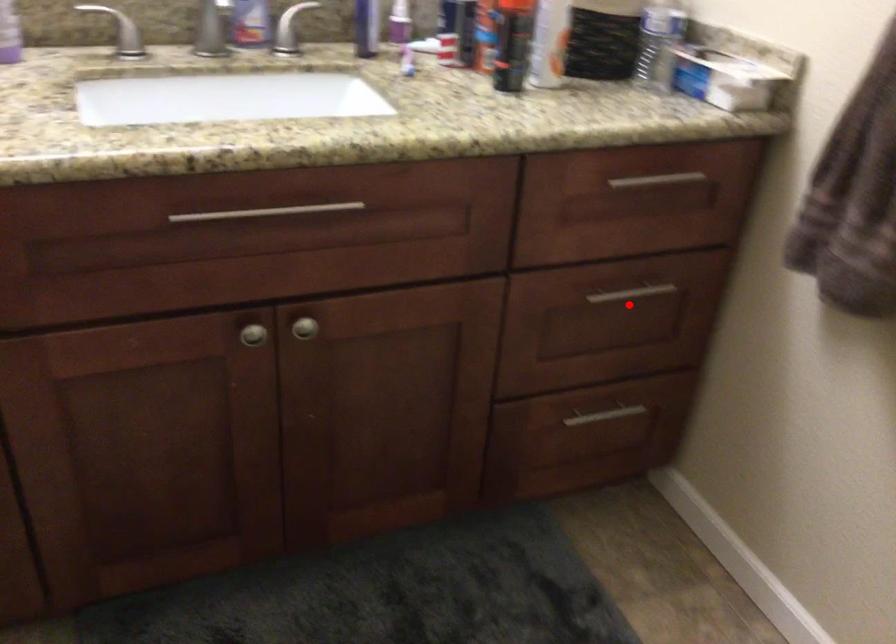
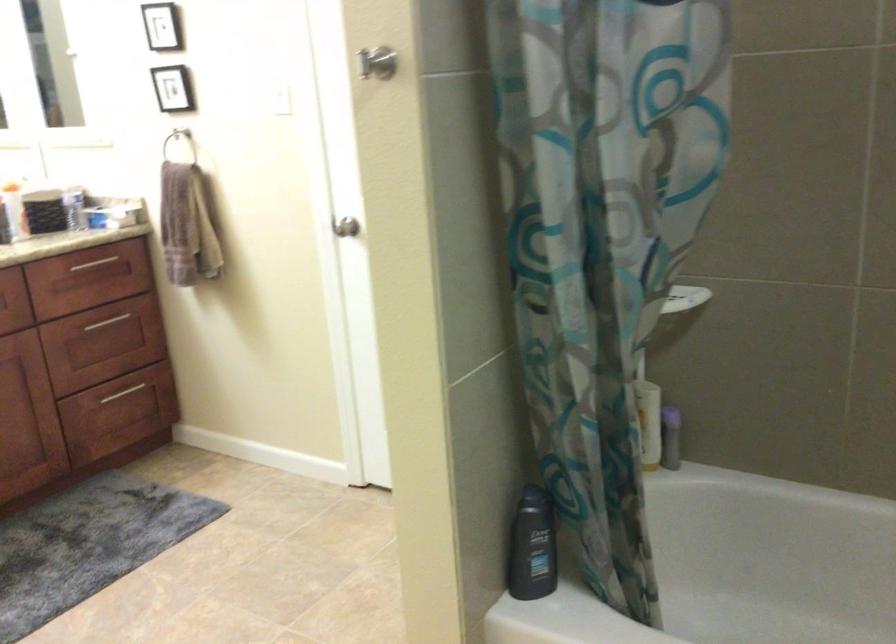
Where in the second image is the point corresponding to the highlighted location from the first image?

(115, 323)